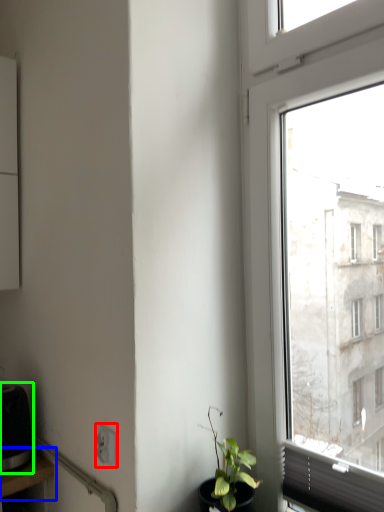
Question: Which object is the farthest from power plugs and sockets (highlighted by a red box)? Choose among these: table (highlighted by a blue box) or appliance (highlighted by a green box).

Choices:
 (A) table
 (B) appliance

Answer: (B)